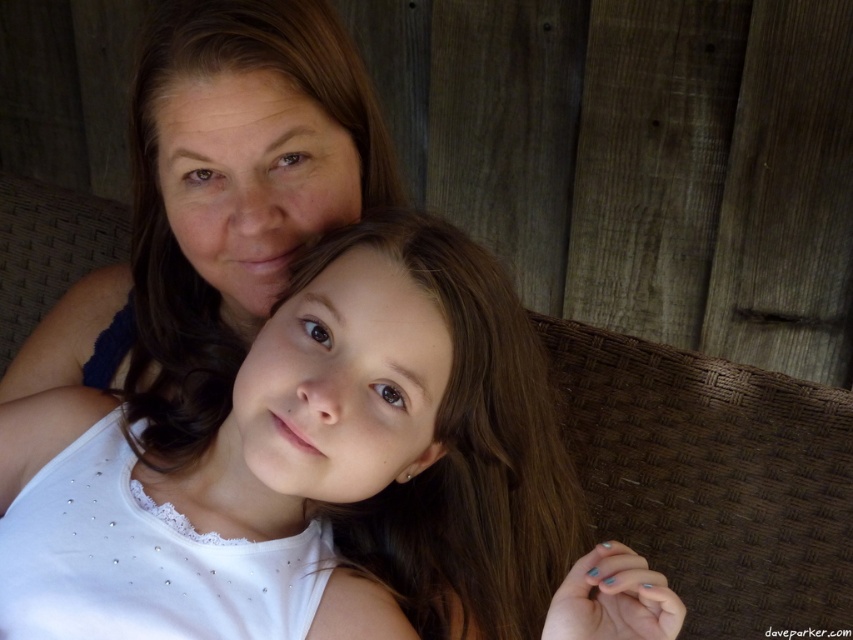
You are a photographer setting up for a family portrait. You notice the white satin blouse at center and the matte blue tank top at upper left. Which clothing item is positioned lower in the image?

The white satin blouse at center is positioned lower than the matte blue tank top at upper left.

You are a fashion designer observing the image. You need to determine which clothing item has a wider silhouette between the white satin blouse at center and the matte blue tank top at upper left. Which one is wider?

The white satin blouse at center has a wider silhouette than the matte blue tank top at upper left, as stated in the description that the white satin blouse at center is larger in width.